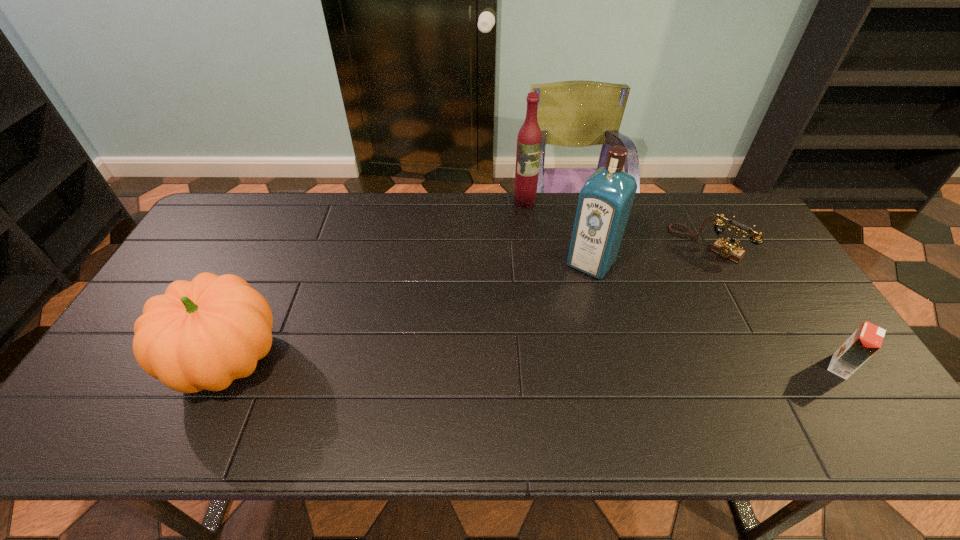
Find the location of a particular element. The height and width of the screenshot is (540, 960). vacant space located 0.150m on the flat label side of the third object from right to left is located at coordinates (556, 310).

Find the location of a particular element. blank space located 0.350m on the flat label side of the third object from right to left is located at coordinates (519, 361).

I want to click on vacant space located 0.270m on the flat label side of the third object from right to left, so click(x=535, y=339).

What are the coordinates of `vacant space located on the label of the farther liquor` in the screenshot? It's located at (531, 228).

Identify the location of blank space located on the label of the farther liquor. (532, 232).

I want to click on vacant space located 0.220m on the label of the farther liquor, so click(537, 251).

Identify the location of free point located on the front-facing side of the fourth object from left to right. (681, 271).

Locate an element on the screen. This screenshot has width=960, height=540. vacant space located on the front-facing side of the fourth object from left to right is located at coordinates (619, 332).

The image size is (960, 540). Identify the location of vacant space located on the front-facing side of the fourth object from left to right. (632, 320).

Identify the location of liquor present at the far edge. (529, 141).